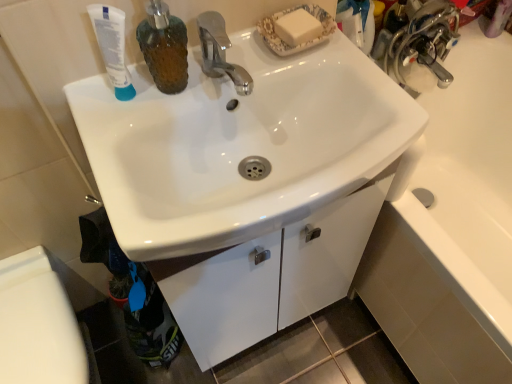
Where is `vacant area in front of brown textured soap dispenser at upper left`? Image resolution: width=512 pixels, height=384 pixels. vacant area in front of brown textured soap dispenser at upper left is located at coordinates (136, 141).